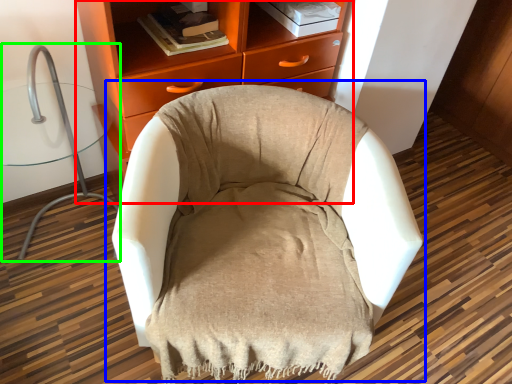
Question: Considering the real-world distances, which object is farthest from chest of drawers (highlighted by a red box)? chair (highlighted by a blue box) or computer chair (highlighted by a green box)?

Choices:
 (A) chair
 (B) computer chair

Answer: (B)